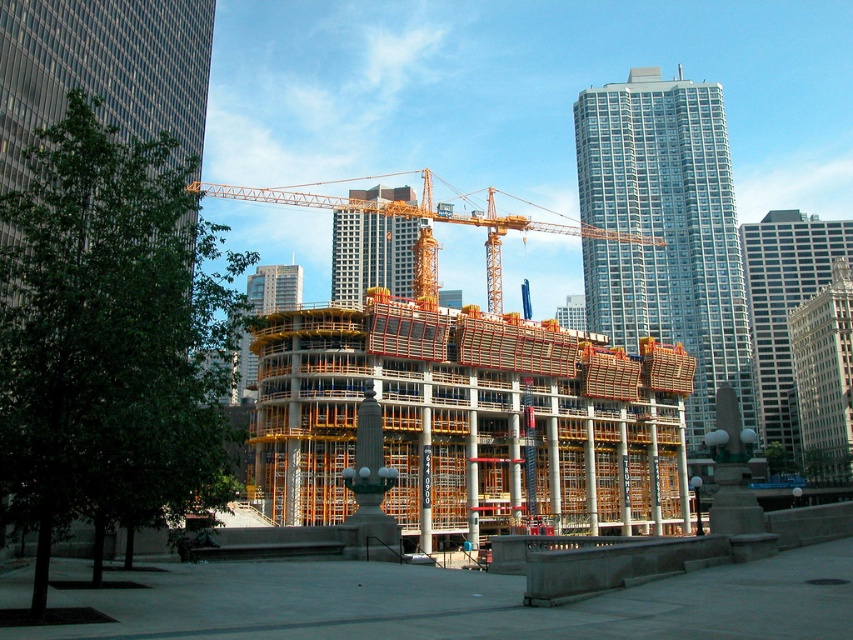
Question: Is glassy steel skyscraper at upper right further to the viewer compared to gray glass skyscraper at center?

Choices:
 (A) no
 (B) yes

Answer: (A)

Question: Among these points, which one is farthest from the camera?

Choices:
 (A) (296, 288)
 (B) (241, 195)
 (C) (814, 221)

Answer: (B)

Question: Which of the following is the closest to the observer?

Choices:
 (A) (412, 257)
 (B) (268, 300)

Answer: (A)

Question: Does glassy steel skyscraper at upper right have a greater width compared to metallic glass building at center?

Choices:
 (A) yes
 (B) no

Answer: (A)

Question: Is glassy steel skyscraper at upper right to the left of white glass skyscraper at center from the viewer's perspective?

Choices:
 (A) yes
 (B) no

Answer: (A)

Question: Which of the following is the farthest from the observer?

Choices:
 (A) metallic glass building at center
 (B) white glass skyscraper at center
 (C) gray glass skyscraper at center
 (D) orange metallic crane at center

Answer: (B)